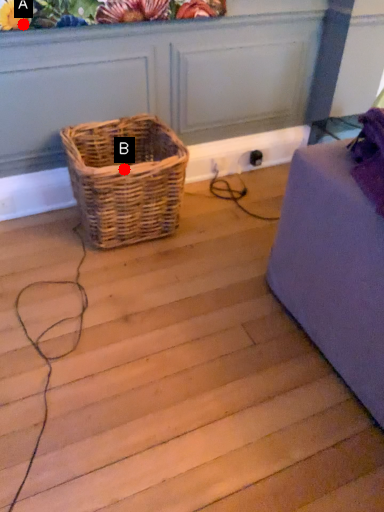
Question: Two points are circled on the image, labeled by A and B beside each circle. Which point appears farthest from the camera in this image?

Choices:
 (A) A is further
 (B) B is further

Answer: (B)